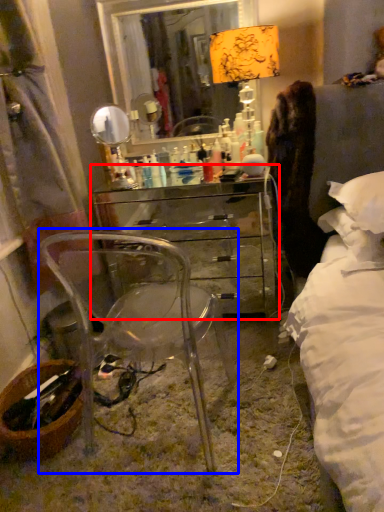
Question: Which object is further to the camera taking this photo, chest of drawers (highlighted by a red box) or chair (highlighted by a blue box)?

Choices:
 (A) chest of drawers
 (B) chair

Answer: (A)